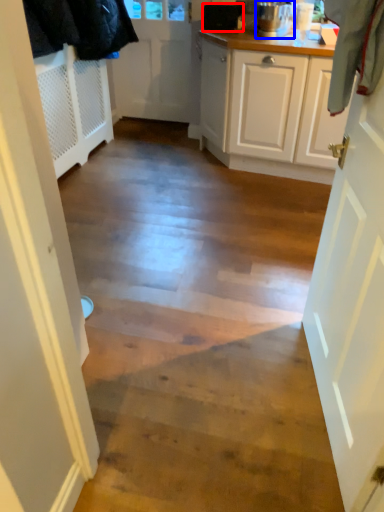
Question: Which of the following is the farthest to the observer, appliance (highlighted by a red box) or kitchen appliance (highlighted by a blue box)?

Choices:
 (A) appliance
 (B) kitchen appliance

Answer: (A)